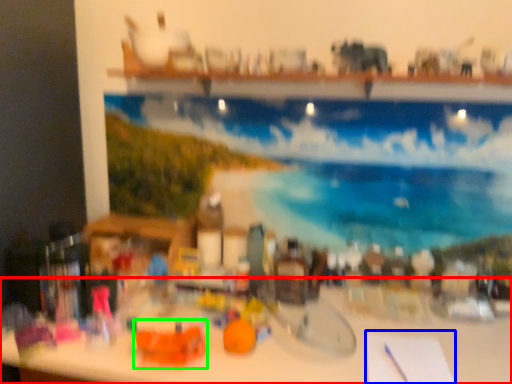
Question: Based on their relative distances, which object is nearer to table (highlighted by a red box)? Choose from notepad (highlighted by a blue box) and toy (highlighted by a green box).

Choices:
 (A) notepad
 (B) toy

Answer: (A)